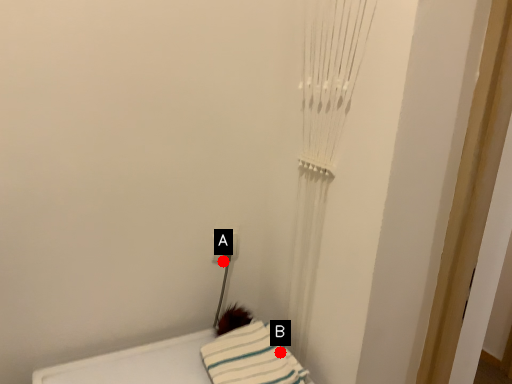
Question: Two points are circled on the image, labeled by A and B beside each circle. Which point is closer to the camera taking this photo?

Choices:
 (A) A is closer
 (B) B is closer

Answer: (B)